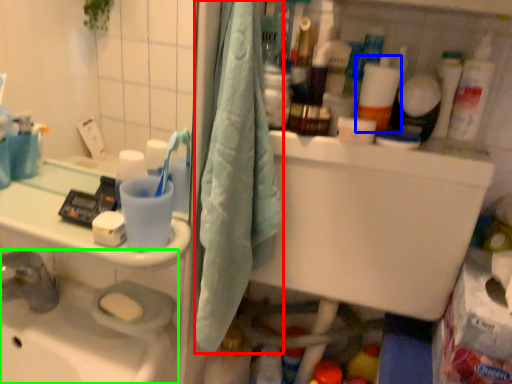
Question: Based on their relative distances, which object is farther from bath towel (highlighted by a red box)? Choose from cleaning product (highlighted by a blue box) and sink (highlighted by a green box).

Choices:
 (A) cleaning product
 (B) sink

Answer: (B)